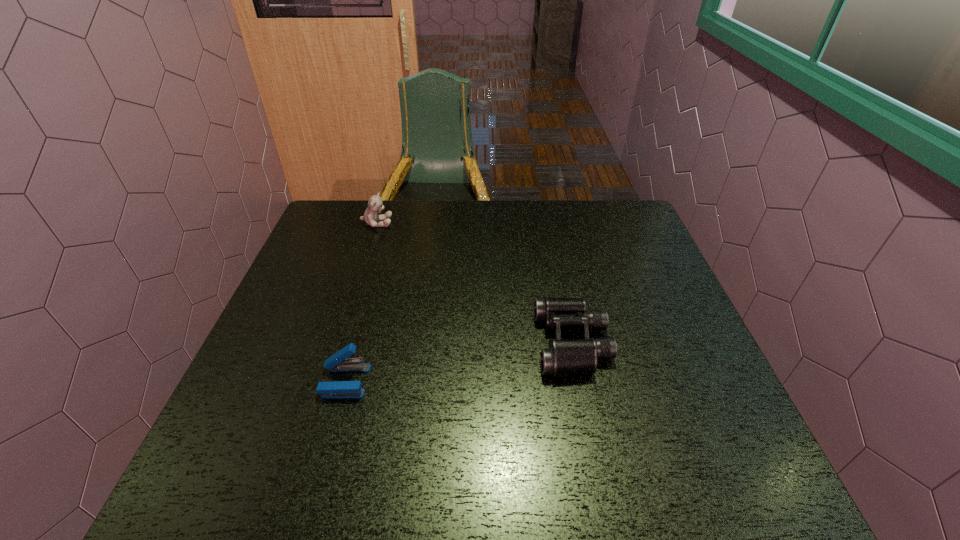
Where is `unoccupied area between the stapler and the teddy bear`? The width and height of the screenshot is (960, 540). unoccupied area between the stapler and the teddy bear is located at coordinates (361, 302).

Identify the location of unoccupied position between the binoculars and the stapler. Image resolution: width=960 pixels, height=540 pixels. (459, 362).

Locate an element on the screen. The width and height of the screenshot is (960, 540). empty space between the stapler and the farthest object is located at coordinates (361, 302).

Where is `blank region between the teddy bear and the binoculars`? blank region between the teddy bear and the binoculars is located at coordinates (475, 283).

Find the location of a particular element. This screenshot has height=540, width=960. vacant point located between the stapler and the farthest object is located at coordinates (361, 302).

Where is `free spot between the stapler and the farthest object`? free spot between the stapler and the farthest object is located at coordinates (361, 302).

Locate which object ranks second in proximity to the stapler. Please provide its 2D coordinates. Your answer should be formatted as a tuple, i.e. [(x, y)], where the tuple contains the x and y coordinates of a point satisfying the conditions above.

[(375, 204)]

Locate an element on the screen. object that ranks as the second closest to the binoculars is located at coordinates (375, 204).

You are a GUI agent. You are given a task and a screenshot of the screen. Output one action in this format:
    pyautogui.click(x=<x>, y=<y>)
    Task: Click on the free space that satisfies the following two spatial constraints: 1. on the face of the stapler; 2. on the left side of the teddy bear
    The width and height of the screenshot is (960, 540).
    Given the screenshot: What is the action you would take?
    pyautogui.click(x=327, y=381)

Identify the location of vacant area in the image that satisfies the following two spatial constraints: 1. on the face of the farthest object; 2. on the back side of the stapler. The width and height of the screenshot is (960, 540). (327, 381).